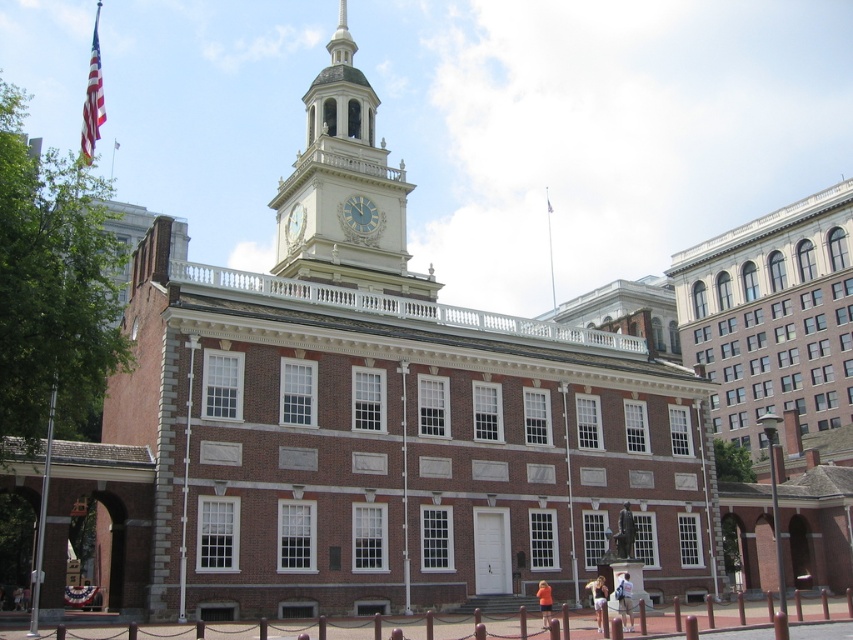
Who is more distant from viewer, (601, 600) or (543, 589)?

Point (543, 589)

Does denim shorts at lower center have a lesser width compared to orange fabric shirt at lower center?

No, denim shorts at lower center is not thinner than orange fabric shirt at lower center.

You are a GUI agent. You are given a task and a screenshot of the screen. Output one action in this format:
    pyautogui.click(x=<x>, y=<y>)
    Task: Click on the denim shorts at lower center
    The image size is (853, 640).
    Given the screenshot: What is the action you would take?
    pyautogui.click(x=598, y=596)

Can you confirm if gold-bronze clock tower at upper center is shorter than denim shorts at lower center?

No.

How far apart are gold-bronze clock tower at upper center and denim shorts at lower center?

The distance of gold-bronze clock tower at upper center from denim shorts at lower center is 39.47 meters.

Is point (396, 186) closer to viewer compared to point (596, 628)?

No, it is not.

The image size is (853, 640). What are the coordinates of `gold-bronze clock tower at upper center` in the screenshot? It's located at (346, 188).

Does metallic clock face at center have a smaller size compared to american flag at upper center?

Yes.

What do you see at coordinates (360, 214) in the screenshot? Image resolution: width=853 pixels, height=640 pixels. I see `metallic clock face at center` at bounding box center [360, 214].

At what (x,y) coordinates should I click in order to perform the action: click on metallic clock face at center. Please return your answer as a coordinate pair (x, y). The height and width of the screenshot is (640, 853). Looking at the image, I should click on (360, 214).